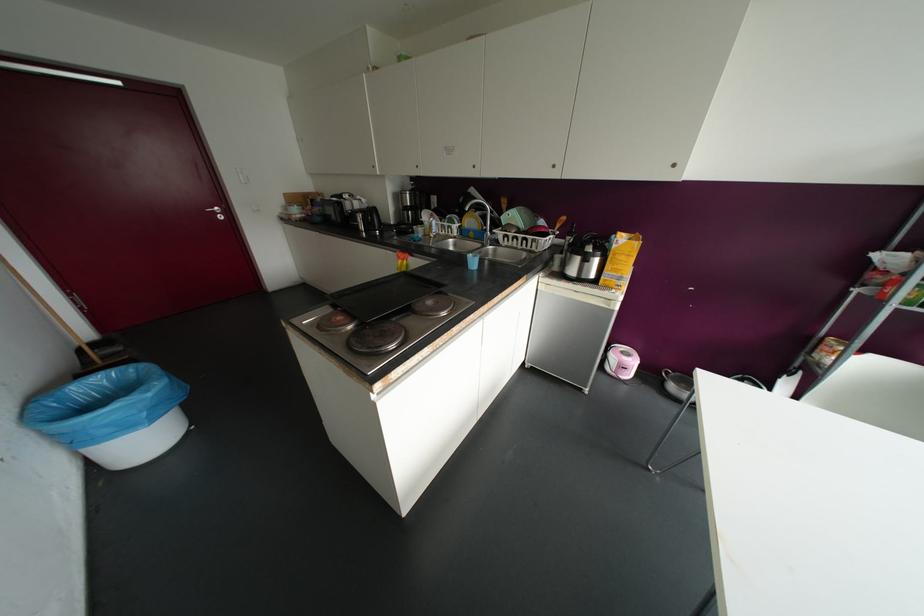
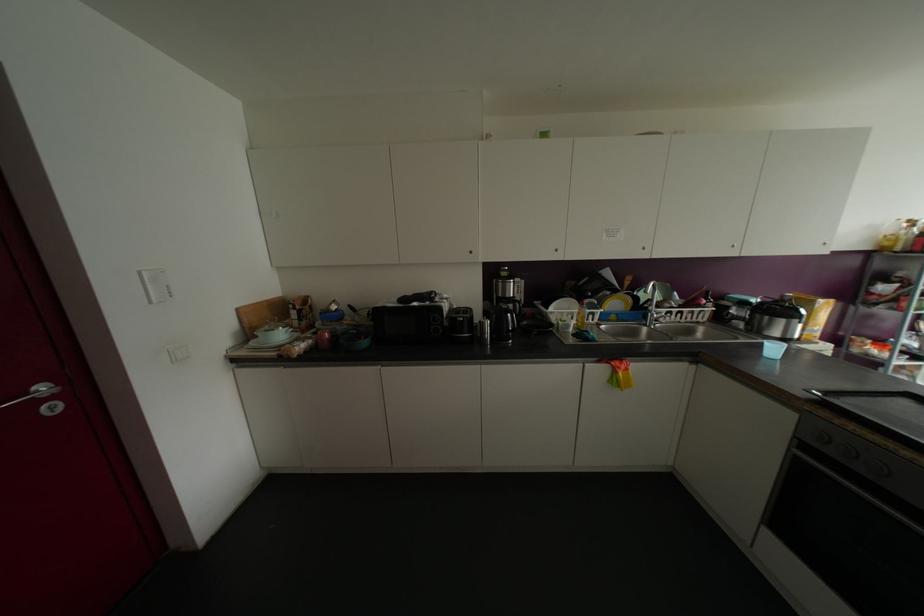
In the second image, find the point that corresponds to (x=473, y=166) in the first image.

(642, 248)